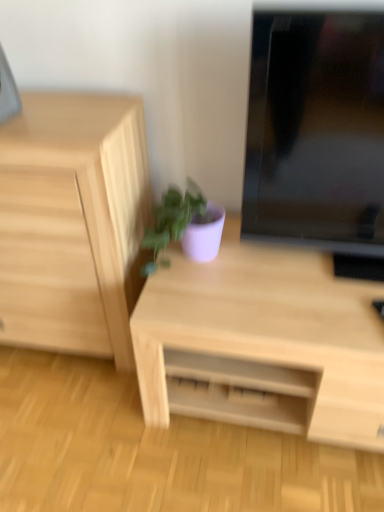
Question: Does point (99, 110) appear closer or farther from the camera than point (162, 196)?

Choices:
 (A) closer
 (B) farther

Answer: (A)

Question: Considering the positions of light wood chest of drawers at left and matte purple pot at center in the image, is light wood chest of drawers at left taller or shorter than matte purple pot at center?

Choices:
 (A) tall
 (B) short

Answer: (A)

Question: Considering the real-world distances, which object is closest to the matte purple pot at center?

Choices:
 (A) black glossy monitor at upper right
 (B) light wood desk at center
 (C) light wood chest of drawers at left

Answer: (C)

Question: Which object is positioned farthest from the black glossy monitor at upper right?

Choices:
 (A) light wood desk at center
 (B) light wood chest of drawers at left
 (C) matte purple pot at center

Answer: (B)